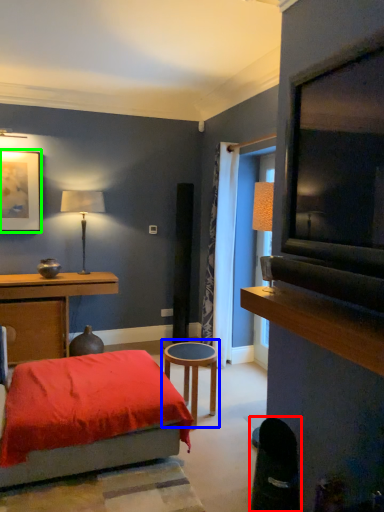
Question: Which object is positioned closest to swivel chair (highlighted by a red box)? Select from table (highlighted by a blue box) and picture frame (highlighted by a green box).

Choices:
 (A) table
 (B) picture frame

Answer: (A)